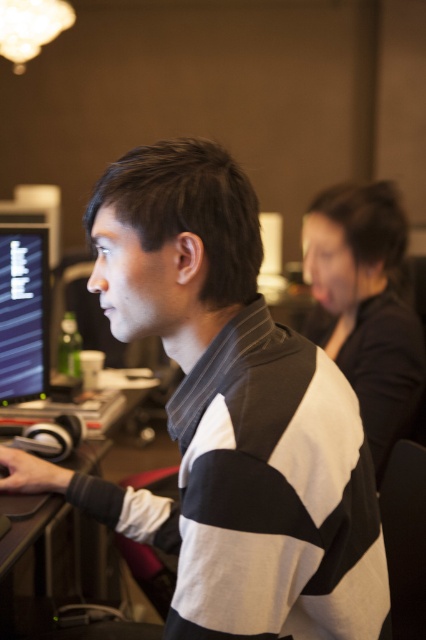
Question: Estimate the real-world distances between objects in this image. Which object is closer to the black plastic computer desk at lower left?

Choices:
 (A) black matte shirt at upper right
 (B) white striped sweater at center
 (C) matte black monitor at left

Answer: (C)

Question: Among these objects, which one is nearest to the camera?

Choices:
 (A) white striped sweater at center
 (B) matte black monitor at left
 (C) black plastic computer desk at lower left
 (D) black matte shirt at upper right

Answer: (A)

Question: Is white striped sweater at center to the left of matte black monitor at left from the viewer's perspective?

Choices:
 (A) no
 (B) yes

Answer: (A)

Question: Can you confirm if white striped sweater at center is positioned to the right of matte black monitor at left?

Choices:
 (A) no
 (B) yes

Answer: (B)

Question: Is matte black monitor at left thinner than black plastic computer desk at lower left?

Choices:
 (A) yes
 (B) no

Answer: (A)

Question: Considering the real-world distances, which object is closest to the black matte shirt at upper right?

Choices:
 (A) black plastic computer desk at lower left
 (B) white striped sweater at center

Answer: (B)